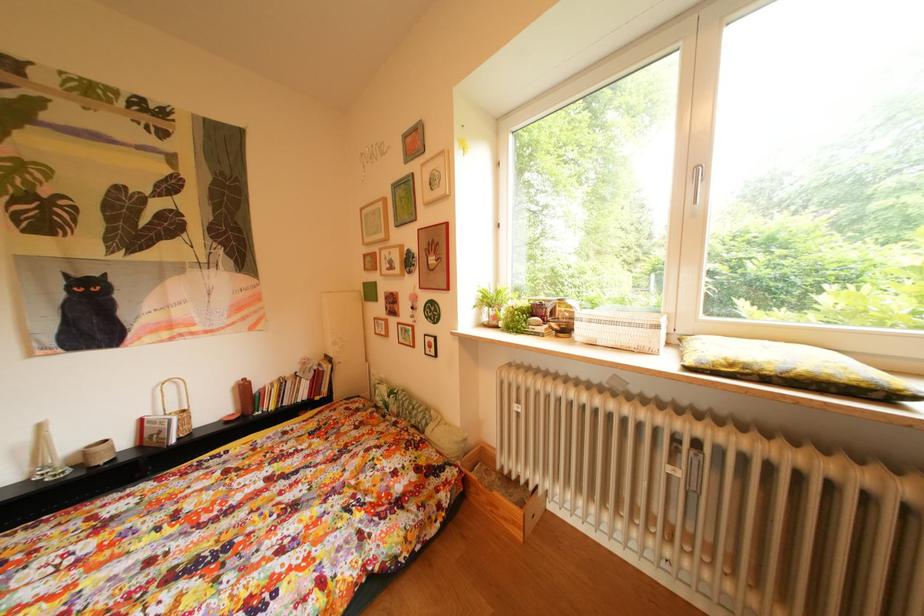
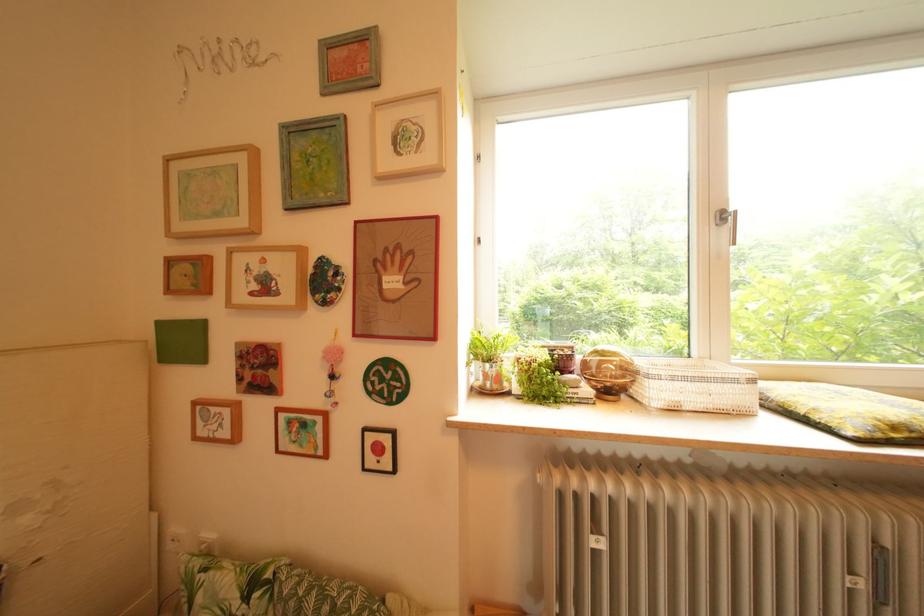
Question: The camera is either moving clockwise (left) or counter-clockwise (right) around the object. The first image is from the beginning of the video and the second image is from the end. Is the camera moving left or right when shooting the video?

Choices:
 (A) Left
 (B) Right

Answer: (A)